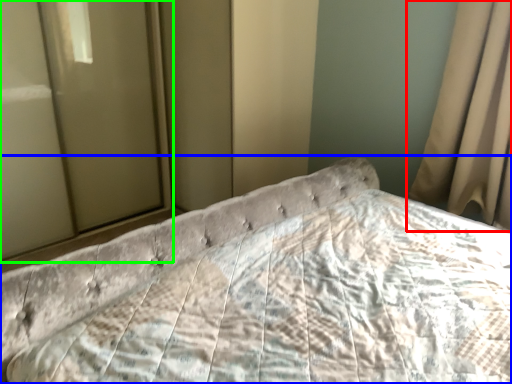
Question: Based on their relative distances, which object is farther from curtain (highlighted by a red box)? Choose from bed (highlighted by a blue box) and glass door (highlighted by a green box).

Choices:
 (A) bed
 (B) glass door

Answer: (B)